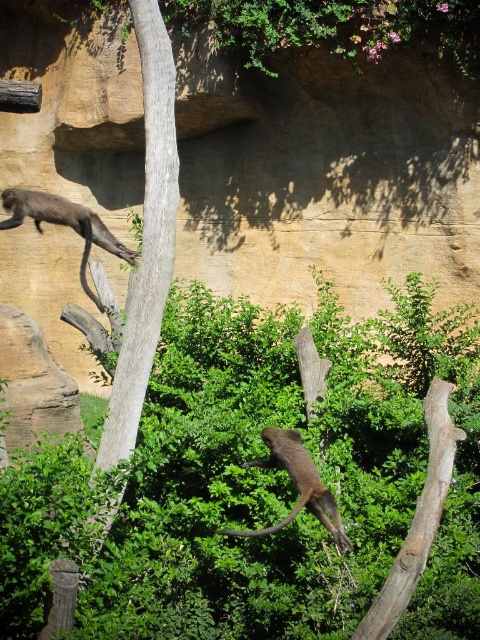
Which of these two, brown rough tree trunk at center or brown furry monkey at center, stands shorter?

brown furry monkey at center is shorter.

Who is more forward, [172,195] or [273,456]?

Point [273,456] is more forward.

This screenshot has height=640, width=480. I want to click on brown rough tree trunk at center, so click(145, 240).

Image resolution: width=480 pixels, height=640 pixels. In order to click on brown rough tree trunk at center in this screenshot , I will do `click(145, 240)`.

Does brown rough tree trunk at center come in front of brown furry monkey at upper left?

That is True.

Which is behind, point (149, 216) or point (34, 214)?

The point (34, 214) is more distant.

You are a GUI agent. You are given a task and a screenshot of the screen. Output one action in this format:
    pyautogui.click(x=<x>, y=<y>)
    Task: Click on the brown rough tree trunk at center
    
    Given the screenshot: What is the action you would take?
    tap(145, 240)

Who is shorter, brown furry monkey at center or brown furry monkey at upper left?

brown furry monkey at upper left

Based on the photo, is the position of brown furry monkey at center less distant than that of brown furry monkey at upper left?

Yes.

The width and height of the screenshot is (480, 640). Describe the element at coordinates (297, 484) in the screenshot. I see `brown furry monkey at center` at that location.

Image resolution: width=480 pixels, height=640 pixels. What are the coordinates of `brown furry monkey at center` in the screenshot? It's located at (297, 484).